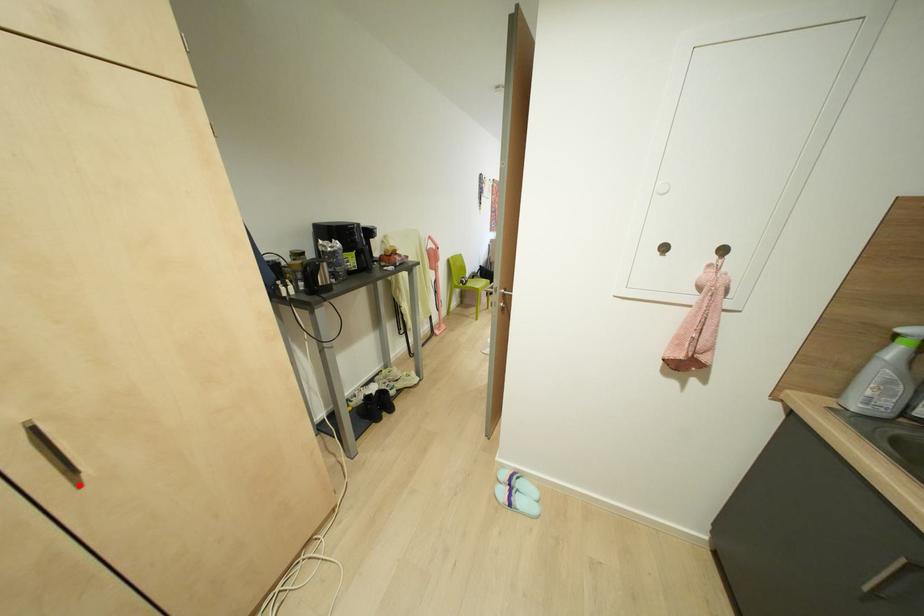
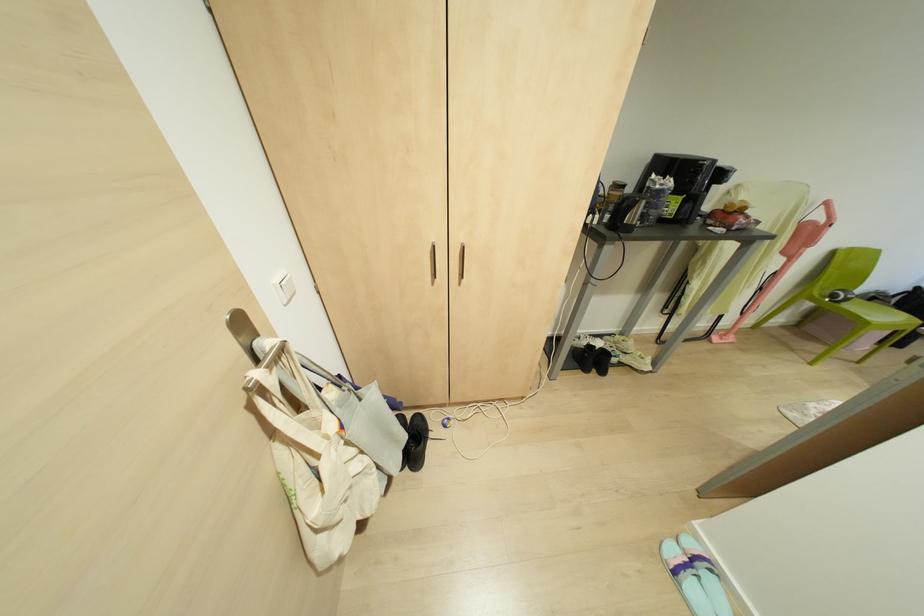
Find the pixel in the second image that matches the highlighted location in the first image.

(458, 284)